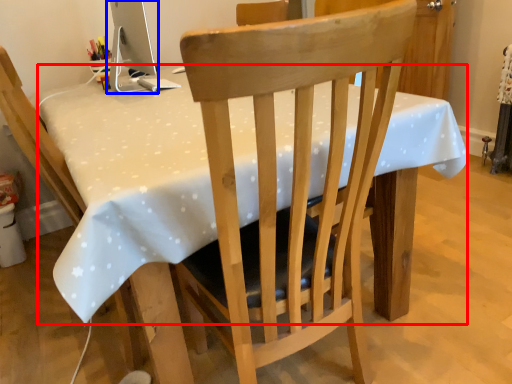
Question: Which object appears farthest to the camera in this image, table (highlighted by a red box) or computer monitor (highlighted by a blue box)?

Choices:
 (A) table
 (B) computer monitor

Answer: (B)